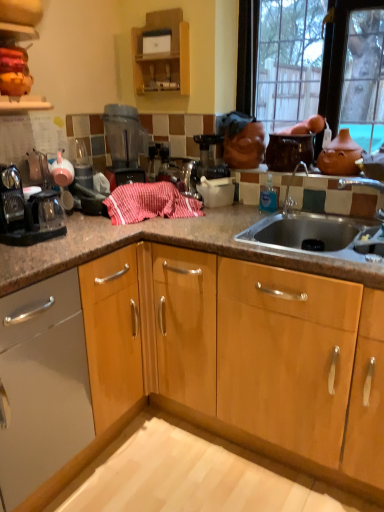
The image size is (384, 512). Describe the element at coordinates (162, 55) in the screenshot. I see `wooden cabinet at upper center` at that location.

Describe the element at coordinates (124, 144) in the screenshot. I see `transparent plastic blender at upper center` at that location.

Find the location of a particular element. terracotta clay teapot at upper right is located at coordinates (340, 156).

Can you confirm if matte glass window at upper right is bigger than terracotta clay teapot at upper right?

Indeed, matte glass window at upper right has a larger size compared to terracotta clay teapot at upper right.

Is matte glass window at upper right positioned beyond the bounds of terracotta clay teapot at upper right?

Yes, matte glass window at upper right is outside of terracotta clay teapot at upper right.

Is matte glass window at upper right positioned with its back to terracotta clay teapot at upper right?

Absolutely, matte glass window at upper right is directed away from terracotta clay teapot at upper right.

From a real-world perspective, is matte glass window at upper right positioned under terracotta clay teapot at upper right based on gravity?

No, from a real-world perspective, matte glass window at upper right is not below terracotta clay teapot at upper right.

Considering the positions of objects transparent plastic blender at upper center and red striped cloth at center in the image provided, who is more to the right, transparent plastic blender at upper center or red striped cloth at center?

From the viewer's perspective, red striped cloth at center appears more on the right side.

From a real-world perspective, which is physically above, transparent plastic blender at upper center or red striped cloth at center?

From a 3D spatial view, transparent plastic blender at upper center is above.

From the image's perspective, is transparent plastic blender at upper center on red striped cloth at center?

Correct, transparent plastic blender at upper center appears higher than red striped cloth at center in the image.

Does red striped cloth at center come in front of transparent plastic blender at upper center?

Yes, the depth of red striped cloth at center is less than that of transparent plastic blender at upper center.

From a real-world perspective, is red striped cloth at center located beneath transparent plastic blender at upper center?

Indeed, from a real-world perspective, red striped cloth at center is positioned beneath transparent plastic blender at upper center.

What's the angular difference between red striped cloth at center and transparent plastic blender at upper center's facing directions?

The angular difference between red striped cloth at center and transparent plastic blender at upper center is 1.13 degrees.

Which is nearer, (160, 182) or (136, 163)?

Point (160, 182) appears to be closer to the viewer than point (136, 163).

Is wooden cabinet at upper center located within transparent plastic blender at upper center?

No, wooden cabinet at upper center is not a part of transparent plastic blender at upper center.

Considering the sizes of objects transparent plastic blender at upper center and wooden cabinet at upper center in the image provided, who is thinner, transparent plastic blender at upper center or wooden cabinet at upper center?

Thinner between the two is wooden cabinet at upper center.

From a real-world perspective, is transparent plastic blender at upper center positioned over wooden cabinet at upper center based on gravity?

Incorrect, from a real-world perspective, transparent plastic blender at upper center is lower than wooden cabinet at upper center.

Is transparent plastic blender at upper center next to wooden cabinet at upper center and touching it?

transparent plastic blender at upper center and wooden cabinet at upper center are not in contact.

Based on the photo, from a real-world perspective, who is located lower, terracotta clay teapot at upper right or red striped cloth at center?

red striped cloth at center is physically lower.

From the image's perspective, which is above, terracotta clay teapot at upper right or red striped cloth at center?

From the image's view, terracotta clay teapot at upper right is above.

Is terracotta clay teapot at upper right oriented towards red striped cloth at center?

No, terracotta clay teapot at upper right does not turn towards red striped cloth at center.

Measure the distance from terracotta clay teapot at upper right to red striped cloth at center.

They are 28.34 inches apart.

Is matte glass window at upper right not close to matte black coffee maker at left?

Yes, matte glass window at upper right and matte black coffee maker at left are located far from each other.

From a real-world perspective, is matte glass window at upper right above or below matte black coffee maker at left?

matte glass window at upper right is above matte black coffee maker at left.

Considering the points (253, 76) and (15, 181), which point is in front, point (253, 76) or point (15, 181)?

The point (15, 181) is in front.

Between matte glass window at upper right and matte black coffee maker at left, which one has smaller size?

Smaller between the two is matte black coffee maker at left.

From the image's perspective, which one is positioned higher, transparent plastic blender at upper center or matte glass window at upper right?

matte glass window at upper right is shown above in the image.

Is transparent plastic blender at upper center looking in the opposite direction of matte glass window at upper right?

No.

The height and width of the screenshot is (512, 384). Find the location of `blender below the matte glass window at upper right (from a real-world perspective)`. blender below the matte glass window at upper right (from a real-world perspective) is located at coordinates (124, 144).

Is matte glass window at upper right a part of transparent plastic blender at upper center?

No, transparent plastic blender at upper center does not contain matte glass window at upper right.

At what (x,y) coordinates should I click in order to perform the action: click on window above the terracotta clay teapot at upper right (from a real-world perspective). Please return your answer as a coordinate pair (x, y). Looking at the image, I should click on (337, 56).

Image resolution: width=384 pixels, height=512 pixels. What are the coordinates of `material that appears in front of the transparent plastic blender at upper center` in the screenshot? It's located at (149, 203).

Estimate the real-world distances between objects in this image. Which object is closer to wooden cabinet at upper center, transparent plastic blender at upper center or matte black coffee maker at left?

transparent plastic blender at upper center is closer to wooden cabinet at upper center.

Considering their positions, is red striped cloth at center positioned closer to wooden cabinet at upper center than transparent plastic blender at upper center?

transparent plastic blender at upper center lies closer to wooden cabinet at upper center than the other object.

Considering their positions, is transparent plastic blender at upper center positioned closer to matte glass window at upper right than terracotta clay teapot at upper right?

The object closer to matte glass window at upper right is terracotta clay teapot at upper right.

When comparing their distances from terracotta clay teapot at upper right, does transparent plastic blender at upper center or wooden cabinet at upper center seem closer?

Among the two, wooden cabinet at upper center is located nearer to terracotta clay teapot at upper right.

Estimate the real-world distances between objects in this image. Which object is further from terracotta clay teapot at upper right, wooden cabinet at upper center or red striped cloth at center?

The object further to terracotta clay teapot at upper right is wooden cabinet at upper center.

Estimate the real-world distances between objects in this image. Which object is further from red striped cloth at center, transparent plastic blender at upper center or wooden cabinet at upper center?

Based on the image, wooden cabinet at upper center appears to be further to red striped cloth at center.

Based on their spatial positions, is red striped cloth at center or wooden cabinet at upper center closer to terracotta clay teapot at upper right?

red striped cloth at center lies closer to terracotta clay teapot at upper right than the other object.

Which object lies nearer to the anchor point wooden cabinet at upper center, red striped cloth at center or matte black coffee maker at left?

Based on the image, red striped cloth at center appears to be nearer to wooden cabinet at upper center.

Locate an element on the screen. material between wooden cabinet at upper center and matte black coffee maker at left vertically is located at coordinates (149, 203).

Locate an element on the screen. cabinetry situated between transparent plastic blender at upper center and terracotta clay teapot at upper right from left to right is located at coordinates (162, 55).

At what (x,y) coordinates should I click in order to perform the action: click on window between matte black coffee maker at left and terracotta clay teapot at upper right in the horizontal direction. Please return your answer as a coordinate pair (x, y). Looking at the image, I should click on (337, 56).

Find the location of a particular element. blender between wooden cabinet at upper center and matte black coffee maker at left in the up-down direction is located at coordinates (124, 144).